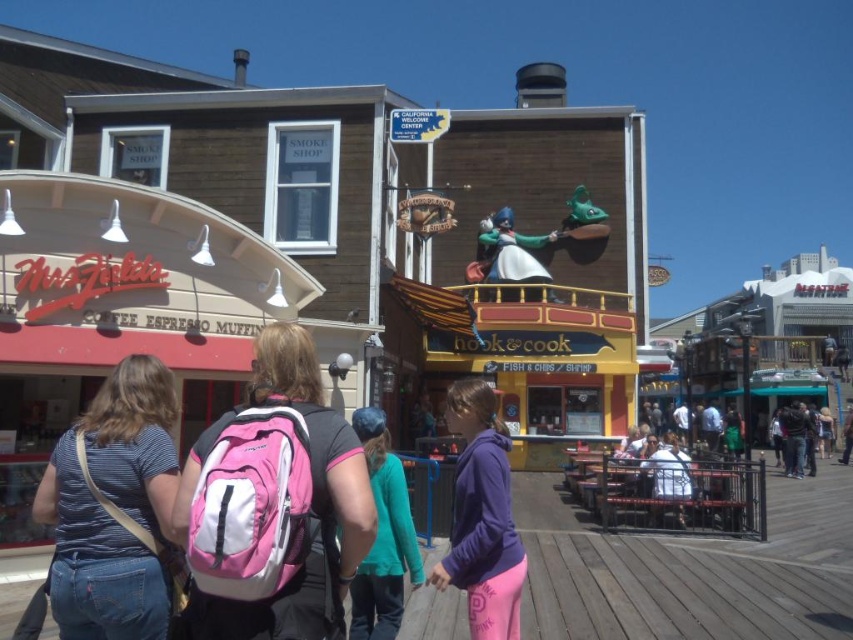
Question: Among these objects, which one is nearest to the camera?

Choices:
 (A) purple fleece jacket at center
 (B) dark blue jeans at center
 (C) pink fabric backpack at center
 (D) white fabric shirt at center

Answer: (C)

Question: Which object appears closest to the camera in this image?

Choices:
 (A) pink fabric backpack at center
 (B) denim jeans at lower left

Answer: (A)

Question: Can you confirm if pink fabric backpack at center is wider than white fabric shirt at center?

Choices:
 (A) no
 (B) yes

Answer: (A)

Question: Does denim jeans at lower left have a smaller size compared to dark blue jeans at center?

Choices:
 (A) yes
 (B) no

Answer: (A)

Question: Which is farther from the denim jeans at lower left?

Choices:
 (A) white fabric shirt at center
 (B) teal fabric shirt at center
 (C) pink fabric backpack at center

Answer: (A)

Question: Does white fabric shirt at center have a smaller size compared to dark blue jeans at center?

Choices:
 (A) yes
 (B) no

Answer: (A)